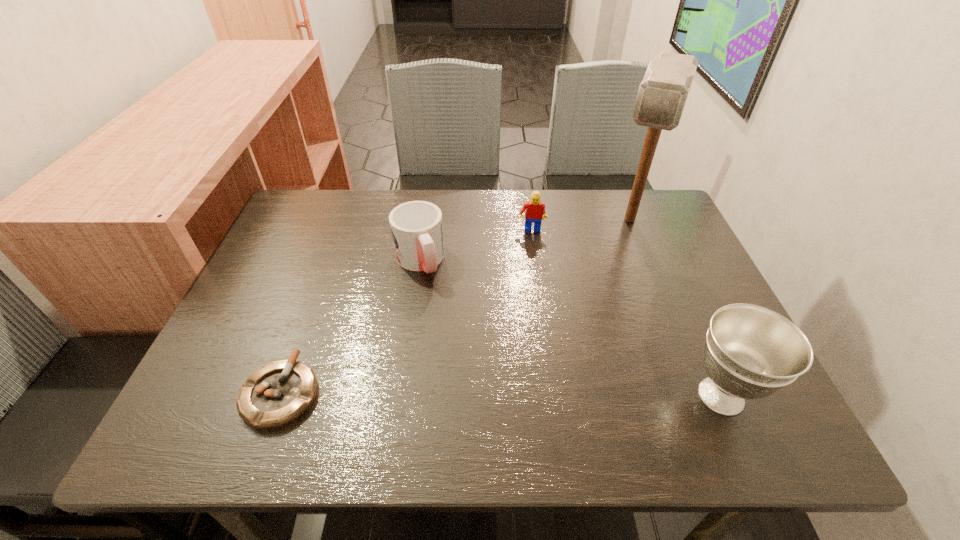
The width and height of the screenshot is (960, 540). I want to click on ashtray, so click(276, 394).

This screenshot has height=540, width=960. Identify the location of the leftmost object. (276, 394).

Image resolution: width=960 pixels, height=540 pixels. What are the coordinates of `chalice` in the screenshot? It's located at (751, 352).

Identify the location of the third object from left to right. (535, 210).

The image size is (960, 540). In order to click on mug in this screenshot , I will do `click(417, 229)`.

You are a GUI agent. You are given a task and a screenshot of the screen. Output one action in this format:
    pyautogui.click(x=<x>, y=<y>)
    Task: Click on the mallet
    The image size is (960, 540).
    Given the screenshot: What is the action you would take?
    pyautogui.click(x=662, y=94)

Where is `vacant space located on the left of the shortest object`? vacant space located on the left of the shortest object is located at coordinates (198, 393).

Where is `vacant space positioned 0.360m on the left of the fourth shortest object`? The width and height of the screenshot is (960, 540). vacant space positioned 0.360m on the left of the fourth shortest object is located at coordinates (495, 396).

The image size is (960, 540). What are the coordinates of `free location located on the front-facing side of the Lego` in the screenshot? It's located at (527, 335).

At what (x,y) coordinates should I click in order to perform the action: click on free space located 0.090m on the front-facing side of the Lego. Please return your answer as a coordinate pair (x, y). The width and height of the screenshot is (960, 540). Looking at the image, I should click on (529, 257).